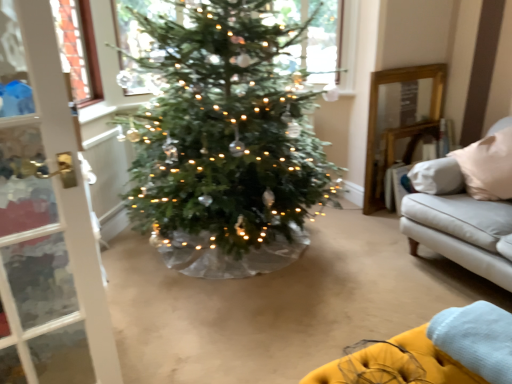
Question: Would you say clear glass window at upper center is outside velvet yellow couch at lower right?

Choices:
 (A) yes
 (B) no

Answer: (A)

Question: Is clear glass window at upper center closer to the viewer compared to velvet yellow couch at lower right?

Choices:
 (A) no
 (B) yes

Answer: (A)

Question: Is velvet yellow couch at lower right inside clear glass window at upper center?

Choices:
 (A) no
 (B) yes

Answer: (A)

Question: Is clear glass window at upper center placed right next to velvet yellow couch at lower right?

Choices:
 (A) yes
 (B) no

Answer: (B)

Question: Is clear glass window at upper center bigger than velvet yellow couch at lower right?

Choices:
 (A) no
 (B) yes

Answer: (A)

Question: From the image's perspective, is yellow fabric blanket at lower right above or below velvet yellow couch at lower right?

Choices:
 (A) above
 (B) below

Answer: (A)

Question: From a real-world perspective, is yellow fabric blanket at lower right above or below velvet yellow couch at lower right?

Choices:
 (A) above
 (B) below

Answer: (A)

Question: Considering their positions, is yellow fabric blanket at lower right located in front of or behind velvet yellow couch at lower right?

Choices:
 (A) front
 (B) behind

Answer: (B)

Question: Looking at their shapes, would you say yellow fabric blanket at lower right is wider or thinner than velvet yellow couch at lower right?

Choices:
 (A) thin
 (B) wide

Answer: (A)

Question: Is point pos(503,367) positioned closer to the camera than point pos(325,74)?

Choices:
 (A) farther
 (B) closer

Answer: (B)

Question: Is yellow fabric blanket at lower right bigger or smaller than clear glass window at upper center?

Choices:
 (A) small
 (B) big

Answer: (A)

Question: Is yellow fabric blanket at lower right inside or outside of clear glass window at upper center?

Choices:
 (A) outside
 (B) inside

Answer: (A)

Question: In terms of width, does yellow fabric blanket at lower right look wider or thinner when compared to clear glass window at upper center?

Choices:
 (A) thin
 (B) wide

Answer: (B)

Question: Based on their positions, is velvet yellow couch at lower right located to the left or right of clear glass window at upper center?

Choices:
 (A) left
 (B) right

Answer: (B)

Question: In terms of size, does velvet yellow couch at lower right appear bigger or smaller than clear glass window at upper center?

Choices:
 (A) big
 (B) small

Answer: (A)